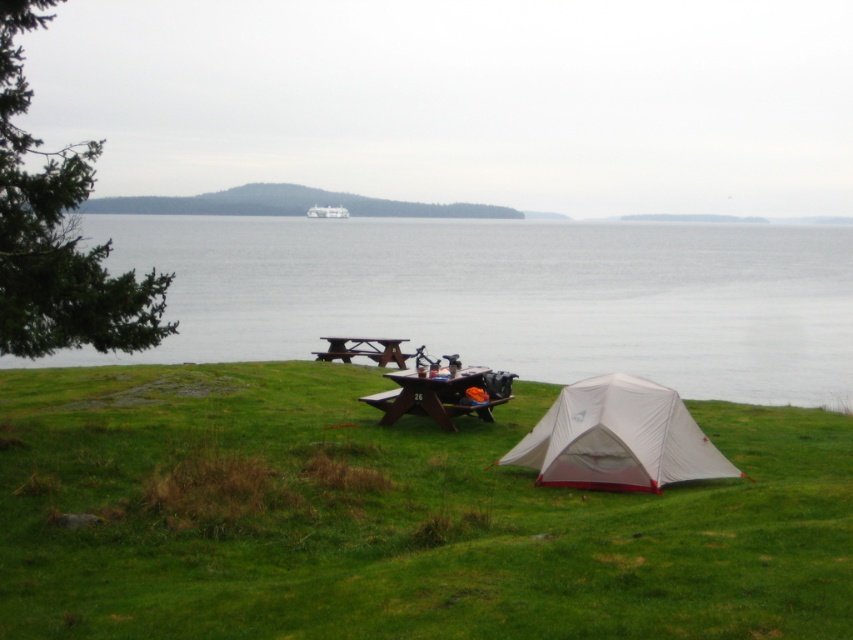
Is wooden picnic table at center positioned at the back of white matte boat at center?

No, it is not.

This screenshot has width=853, height=640. I want to click on wooden picnic table at center, so click(442, 394).

I want to click on wooden picnic table at center, so click(x=442, y=394).

Does transparent water at center have a larger size compared to white nylon tent at lower right?

Yes.

Who is shorter, transparent water at center or white nylon tent at lower right?

With less height is white nylon tent at lower right.

The width and height of the screenshot is (853, 640). Describe the element at coordinates (508, 296) in the screenshot. I see `transparent water at center` at that location.

Where is `transparent water at center`? The image size is (853, 640). transparent water at center is located at coordinates (508, 296).

Is green grassy at lower center smaller than brown wooden picnic table at center?

Incorrect, green grassy at lower center is not smaller in size than brown wooden picnic table at center.

Does point (88, 531) come in front of point (393, 346)?

Yes, it is.

The height and width of the screenshot is (640, 853). In order to click on green grassy at lower center in this screenshot , I will do `click(392, 516)`.